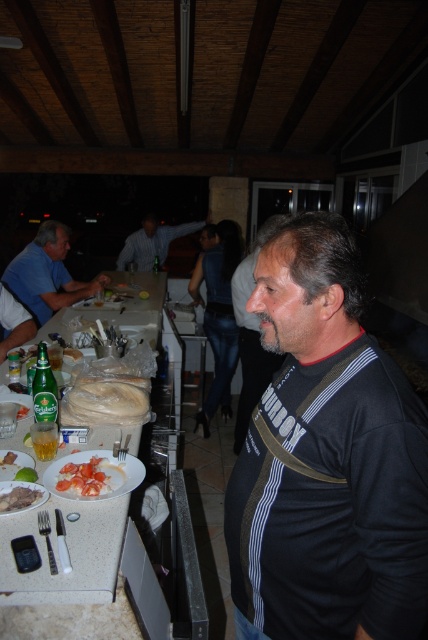
You are a waiter in this dining area and need to deliver a drink to the man. The drink needs to be placed on the table between the black jersey at center and the white bread at left. Which object should you place the drink closer to?

The black jersey at center is to the right of white bread at left, so the drink should be placed closer to the white bread at left to ensure it is between both objects.

You are a waiter in this dining area and need to deliver a drink to the man looking towards the left. There is a black jersey at center and tomato slices at center on the table. Which object should you move to access the drink?

The black jersey at center is in front of the tomato slices at center, so you should move the black jersey at center to access the drink.

You are a waiter at an outdoor restaurant. A customer wearing a black jersey at center has ordered a slice of white bread at left. The customer asks if you can bring the bread to their table without touching it. The minimum distance required to avoid touching is 90 centimeters. Can you do it?

The black jersey at center and white bread at left are 92.15 centimeters apart. Since the minimum distance required to avoid touching is 90 centimeters, the distance is sufficient. Yes, you can bring the bread without touching the customer.